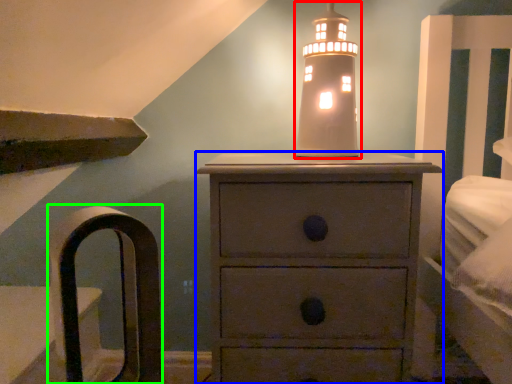
Question: Which is farther away from candle holder (highlighted by a red box)? chest of drawers (highlighted by a blue box) or armchair (highlighted by a green box)?

Choices:
 (A) chest of drawers
 (B) armchair

Answer: (B)